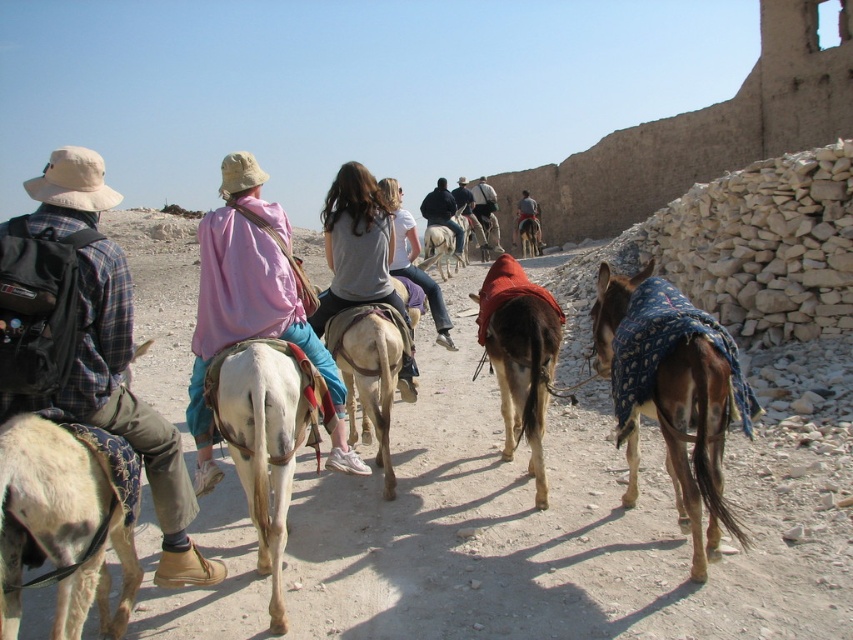
Based on the photo, you are standing in the desert and see two points in the scene. Which point is closer to you, point (169, 464) or point (292, 401)?

Point (169, 464) is closer to the camera than point (292, 401), so the point closer to you is point (169, 464).